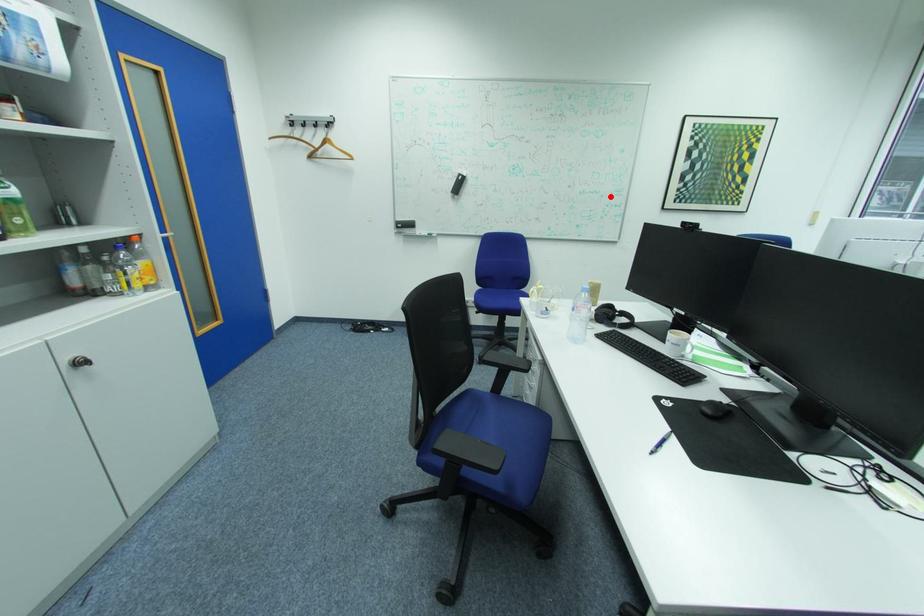
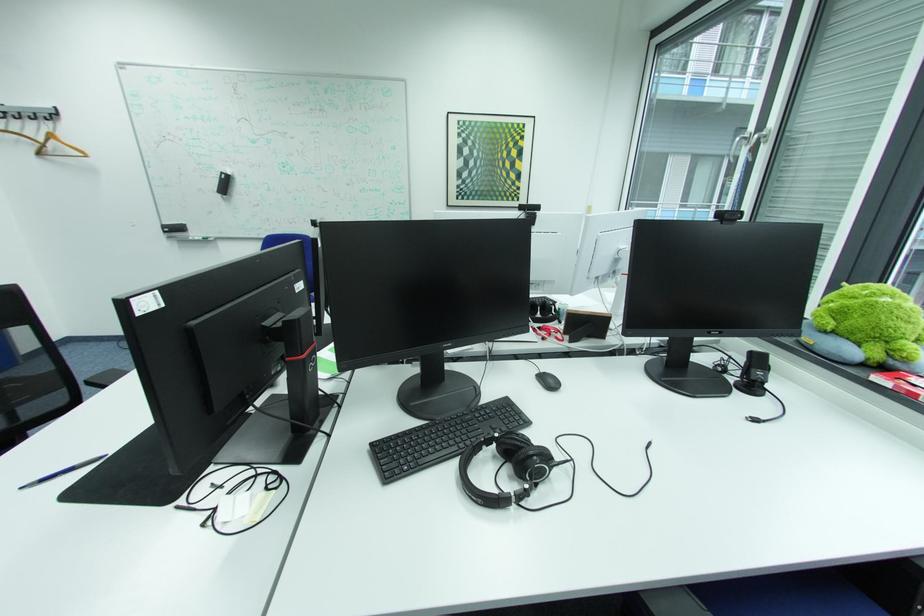
Where in the second image is the point corresponding to the highlighted location from the first image?

(393, 195)